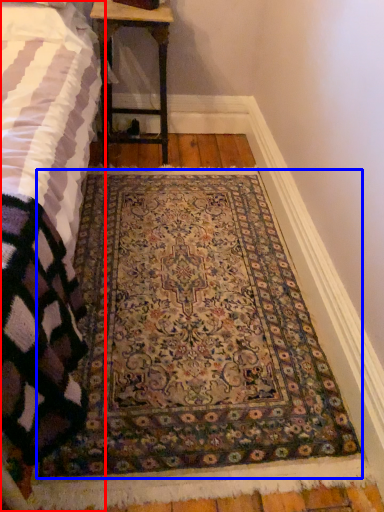
Question: Among these objects, which one is nearest to the camera, bed (highlighted by a red box) or mat (highlighted by a blue box)?

Choices:
 (A) bed
 (B) mat

Answer: (A)